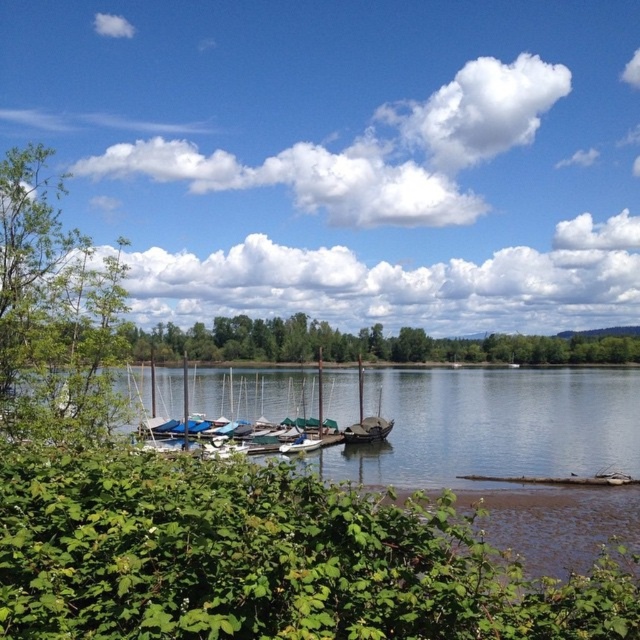
Question: Does green leafy tree at left lie in front of dark brown wooden sailboat at center?

Choices:
 (A) no
 (B) yes

Answer: (B)

Question: Observing the image, what is the correct spatial positioning of green leafy tree at left in reference to dark brown wooden sailboat at center?

Choices:
 (A) right
 (B) left

Answer: (B)

Question: Which point appears closest to the camera in this image?

Choices:
 (A) (29, 147)
 (B) (356, 428)

Answer: (A)

Question: Among these points, which one is farthest from the camera?

Choices:
 (A) (81, 300)
 (B) (362, 426)

Answer: (B)

Question: Is green leafy tree at left to the right of dark brown wooden sailboat at center from the viewer's perspective?

Choices:
 (A) yes
 (B) no

Answer: (B)